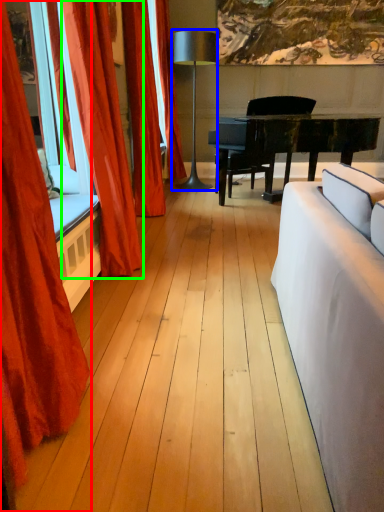
Question: Which object is the closest to the curtain (highlighted by a red box)? Choose among these: lamp (highlighted by a blue box) or curtain (highlighted by a green box).

Choices:
 (A) lamp
 (B) curtain

Answer: (B)